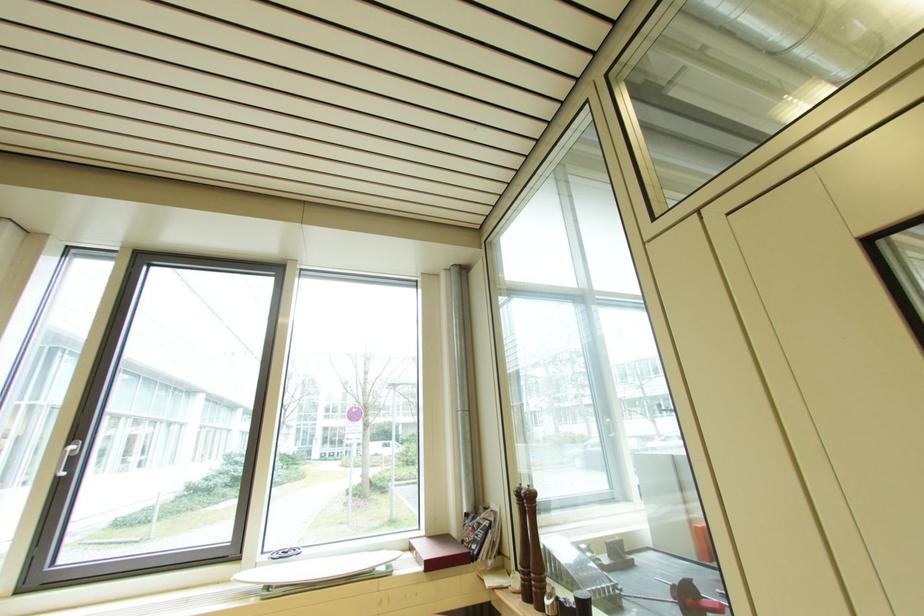
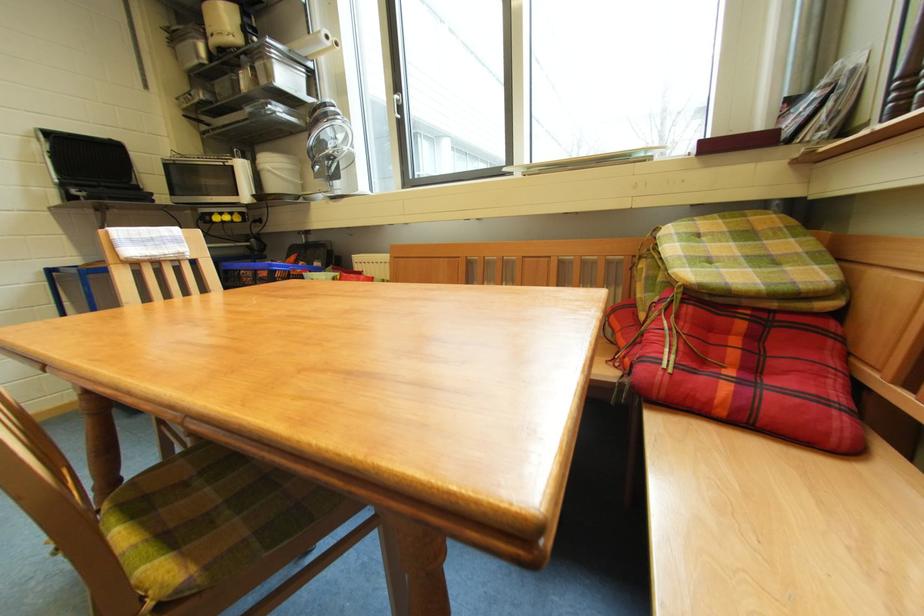
Find the pixel in the second image that matches point (73, 455) in the first image.

(402, 102)